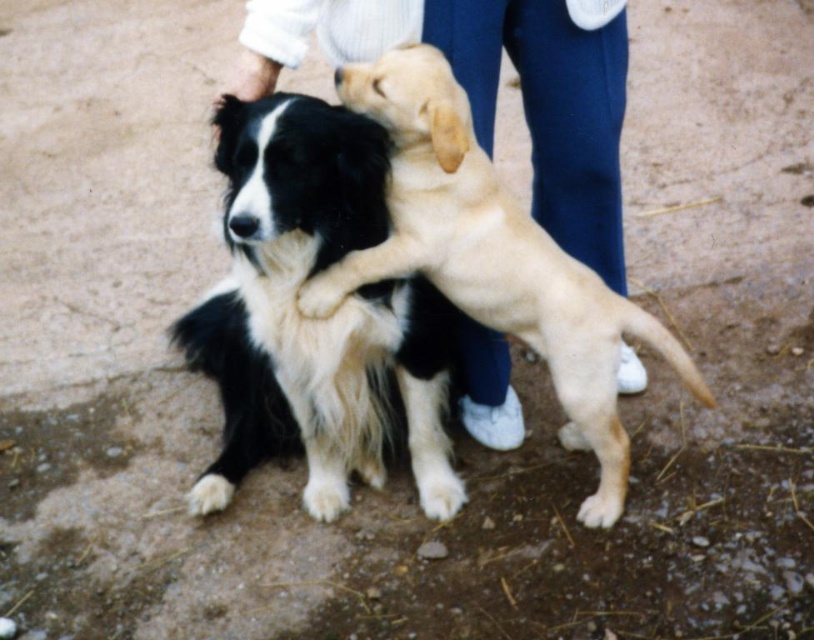
You are standing at the origin point in the image and want to throw a treat to the dog on the left. Which point, point (260,200) or point (326,282), is closer to the dog on the left?

Point (260,200) is closer to the dog on the left because it is in front of point (326,282), which is further away.

You are a photographer taking a picture of the black and white fur dog at center and the white fur paw at center. Which object should be placed to the right side in the photo?

The white fur paw at center should be placed to the right side in the photo because the black and white fur dog at center is positioned on the left side of white fur paw at center.